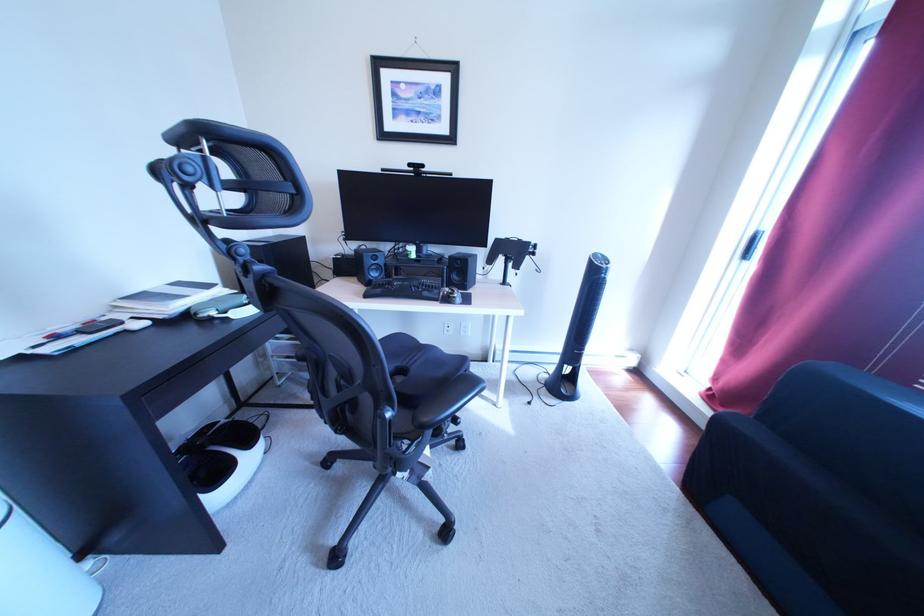
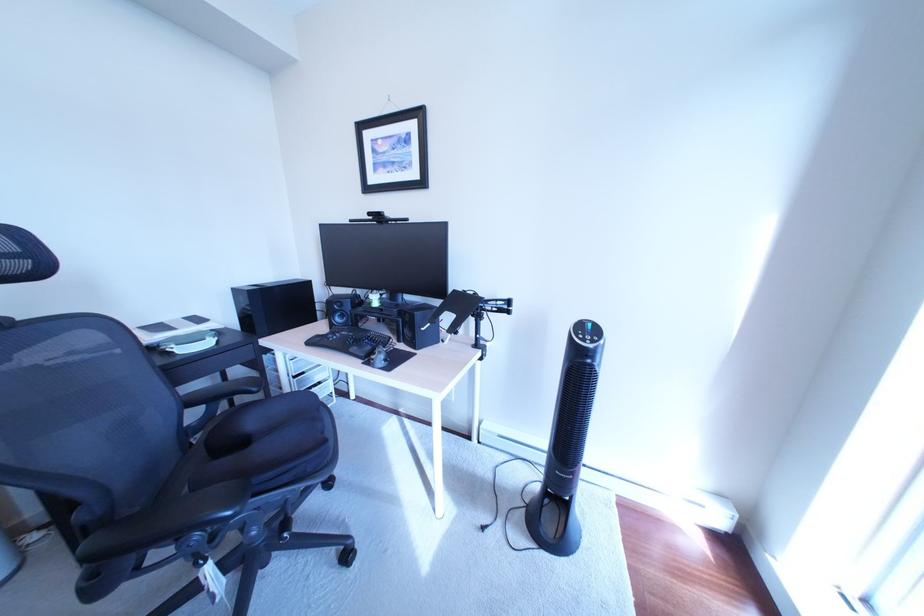
Question: Based on the continuous images, in which direction is the camera rotating? Reply with the corresponding letter.

Choices:
 (A) Left
 (B) Right
 (C) Up
 (D) Down

Answer: (A)